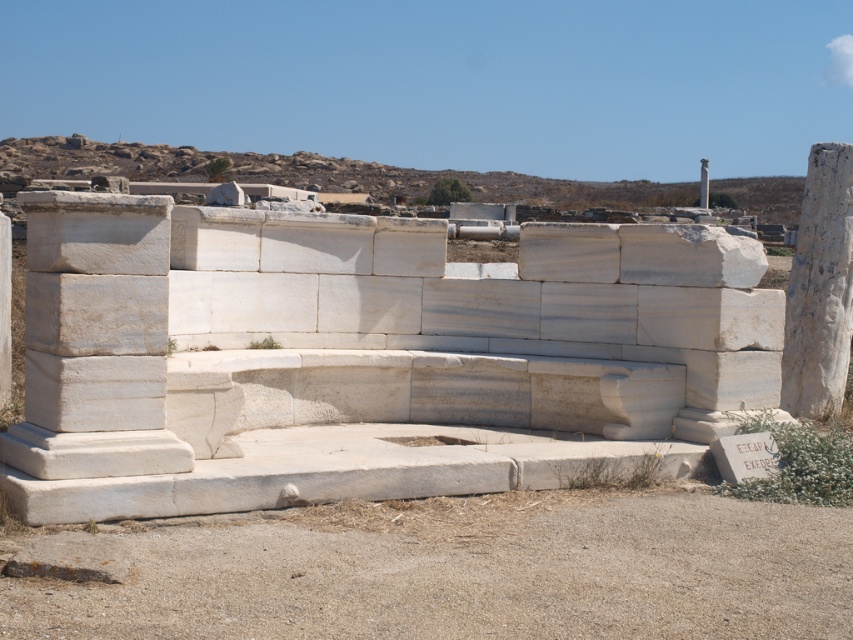
Question: Is white marble pillar at right bigger than white marble pillar at center?

Choices:
 (A) yes
 (B) no

Answer: (B)

Question: Can you confirm if white marble pillar at right is positioned to the right of white marble pillar at left?

Choices:
 (A) yes
 (B) no

Answer: (A)

Question: Based on their relative distances, which object is nearer to the white marble pillar at center?

Choices:
 (A) white marble bench at center
 (B) white marble pillar at right

Answer: (B)

Question: Which object appears closest to the camera in this image?

Choices:
 (A) white marble pillar at right
 (B) white marble pillar at center
 (C) white marble bench at center

Answer: (C)

Question: In this image, where is white marble pillar at left located relative to white marble pillar at center?

Choices:
 (A) above
 (B) below

Answer: (B)

Question: Which of these objects is positioned farthest from the white marble pillar at center?

Choices:
 (A) white marble pillar at left
 (B) white marble pillar at right
 (C) white marble bench at center

Answer: (A)